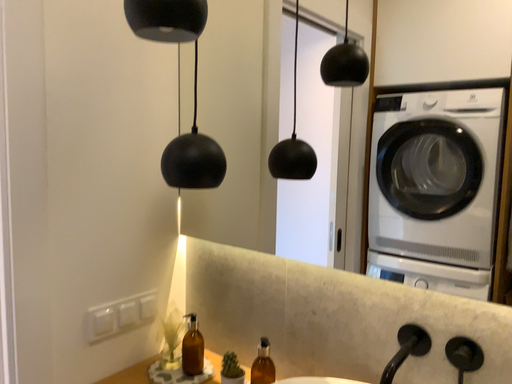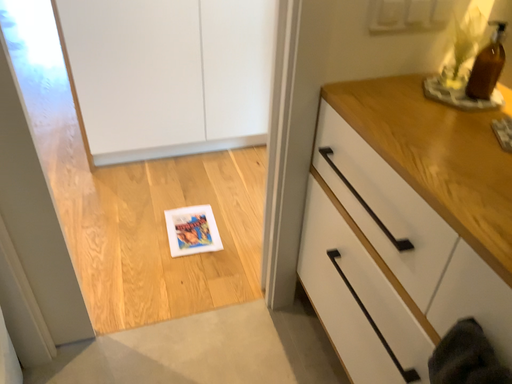
Question: Which way did the camera rotate in the video?

Choices:
 (A) rotated right
 (B) rotated left

Answer: (B)